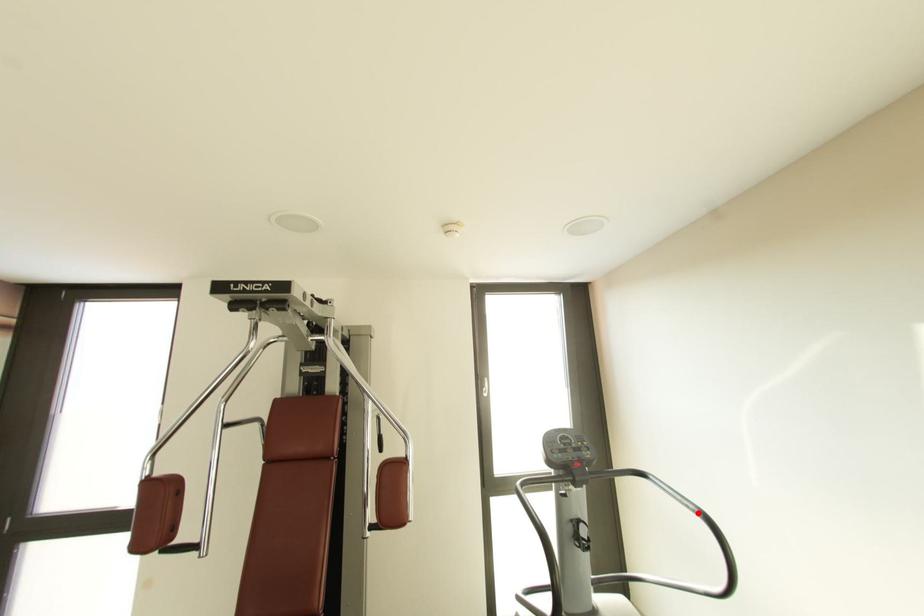
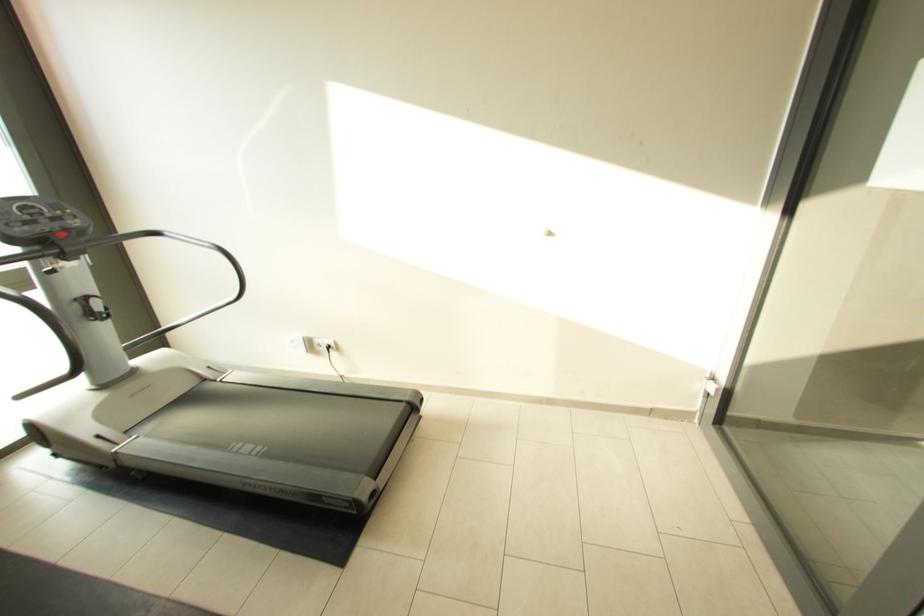
Find the pixel in the second image that matches the highlighted location in the first image.

(214, 249)